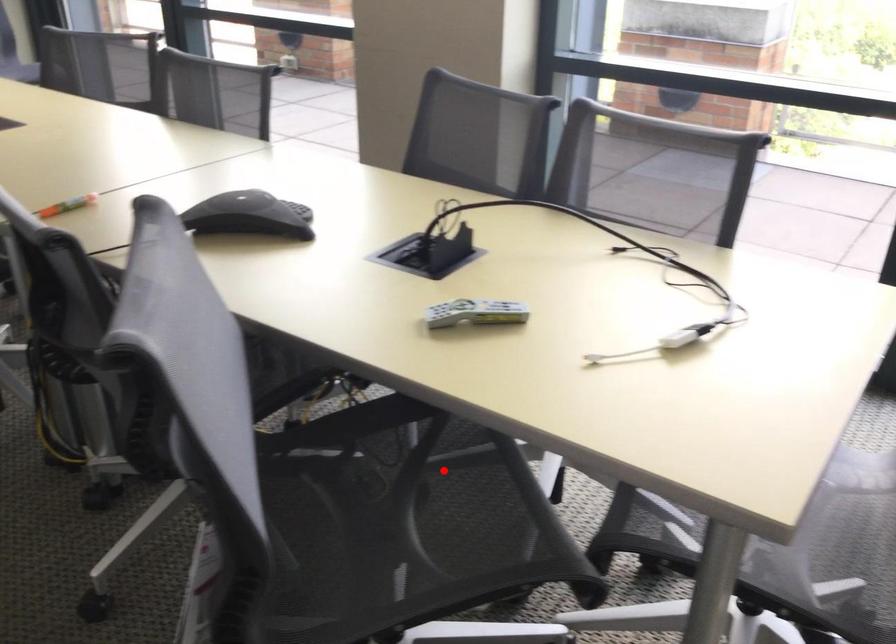
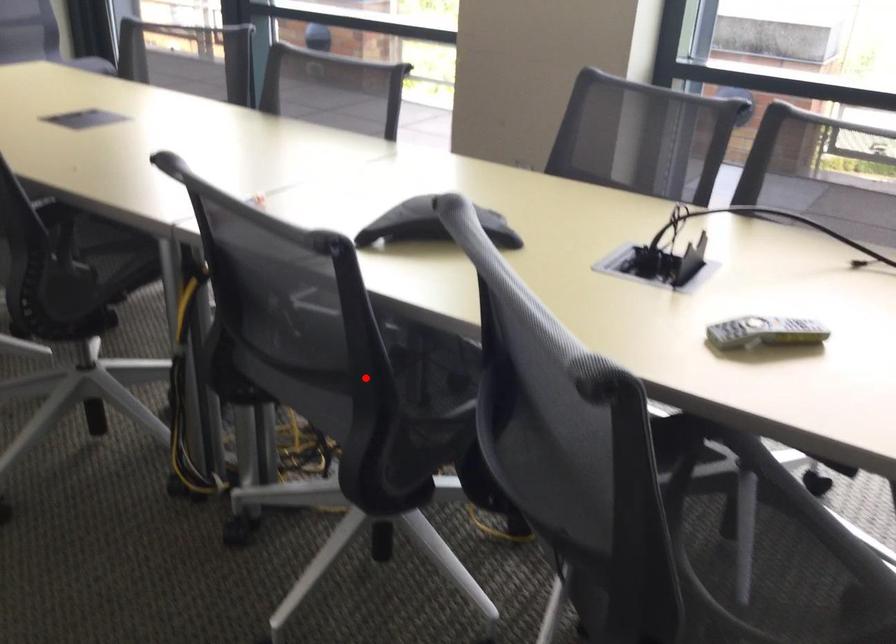
I am providing you with two images of the same scene from different viewpoints. A red point is marked on the first image and another point is marked on the second image. Are the points marked in image1 and image2 representing the same 3D position?

No